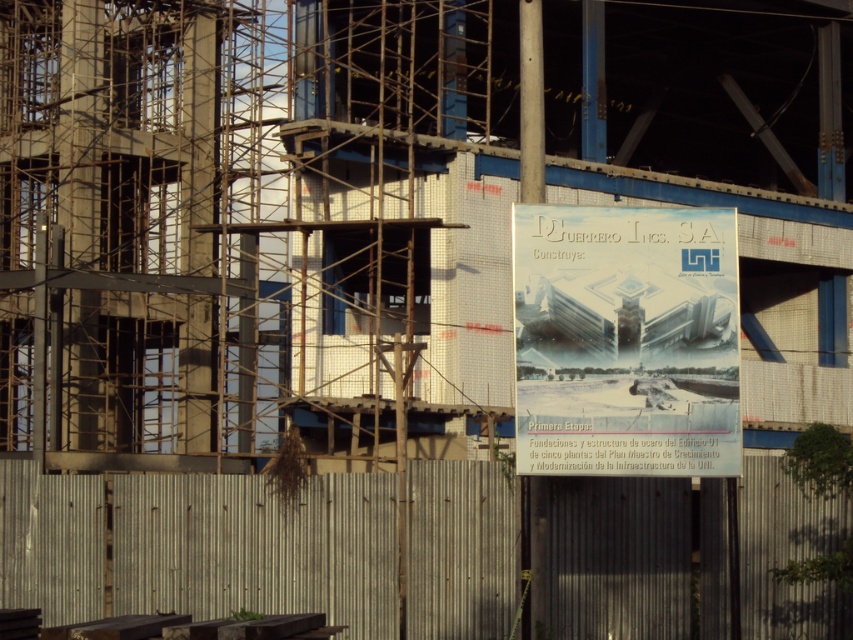
Does metallic corrugated fence at lower center lie behind white paper poster at center?

That is True.

Does metallic corrugated fence at lower center have a lesser width compared to white paper poster at center?

No, metallic corrugated fence at lower center is not thinner than white paper poster at center.

Identify the location of metallic corrugated fence at lower center. The image size is (853, 640). (200, 547).